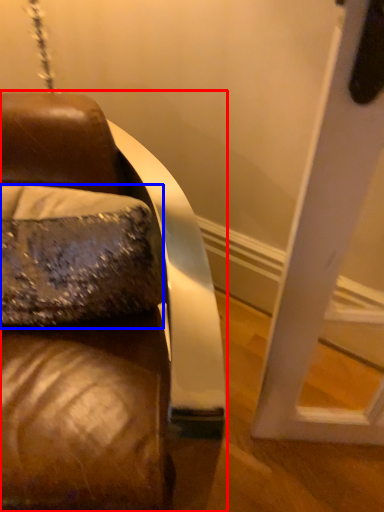
Question: Which object is further to the camera taking this photo, furniture (highlighted by a red box) or throw pillow (highlighted by a blue box)?

Choices:
 (A) furniture
 (B) throw pillow

Answer: (B)